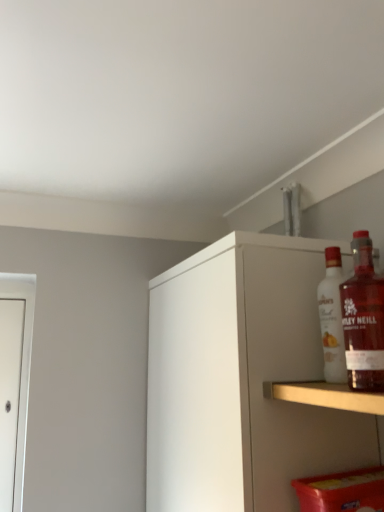
Question: Should I look upward or downward to see translucent glass bottle at upper right, the 1th bottle viewed from the front?

Choices:
 (A) down
 (B) up

Answer: (A)

Question: Is white matte cabinet at upper right shorter than translucent glass bottle at upper right, which ranks as the 2th bottle in back-to-front order?

Choices:
 (A) yes
 (B) no

Answer: (B)

Question: Is translucent glass bottle at upper right, the 1th bottle viewed from the front, located within white matte cabinet at upper right?

Choices:
 (A) yes
 (B) no

Answer: (B)

Question: Does white matte cabinet at upper right have a lesser width compared to translucent glass bottle at upper right, which ranks as the 2th bottle in back-to-front order?

Choices:
 (A) yes
 (B) no

Answer: (B)

Question: Is the depth of white matte cabinet at upper right greater than that of translucent glass bottle at upper right, which ranks as the 2th bottle in back-to-front order?

Choices:
 (A) no
 (B) yes

Answer: (B)

Question: Is white matte cabinet at upper right looking in the opposite direction of translucent glass bottle at upper right, the 1th bottle viewed from the front?

Choices:
 (A) yes
 (B) no

Answer: (B)

Question: From the image's perspective, is white matte cabinet at upper right over translucent glass bottle at upper right, the 1th bottle viewed from the front?

Choices:
 (A) yes
 (B) no

Answer: (B)

Question: From the image's perspective, would you say white glass bottle at upper right, the first bottle when ordered from back to front, is positioned over white matte cabinet at upper right?

Choices:
 (A) no
 (B) yes

Answer: (B)

Question: Does white glass bottle at upper right, which appears as the second bottle when viewed from the front, have a greater height compared to white matte cabinet at upper right?

Choices:
 (A) no
 (B) yes

Answer: (A)

Question: Can you confirm if white glass bottle at upper right, the first bottle when ordered from back to front, is smaller than white matte cabinet at upper right?

Choices:
 (A) no
 (B) yes

Answer: (B)

Question: Is white glass bottle at upper right, the first bottle when ordered from back to front, oriented towards white matte cabinet at upper right?

Choices:
 (A) yes
 (B) no

Answer: (B)

Question: Is white glass bottle at upper right, the first bottle when ordered from back to front, surrounding white matte cabinet at upper right?

Choices:
 (A) no
 (B) yes

Answer: (A)

Question: Is white glass bottle at upper right, which appears as the second bottle when viewed from the front, in front of white matte cabinet at upper right?

Choices:
 (A) yes
 (B) no

Answer: (B)

Question: Is translucent glass bottle at upper right, which ranks as the 2th bottle in back-to-front order, beside white glass bottle at upper right, which appears as the second bottle when viewed from the front?

Choices:
 (A) no
 (B) yes

Answer: (B)